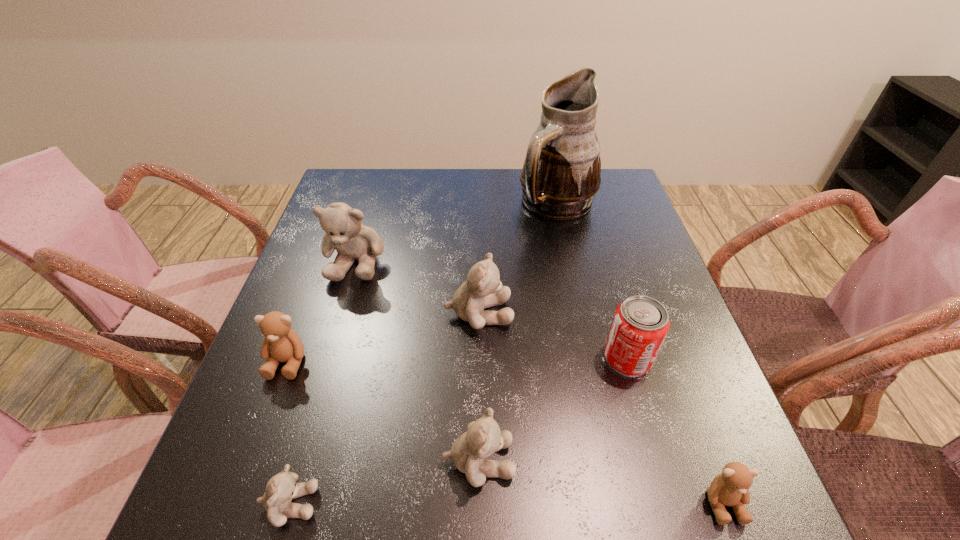
Locate an element on the screen. pitcher is located at coordinates (561, 173).

I want to click on the farthest object, so click(561, 173).

Where is `the farthest gray teddy bear`? The image size is (960, 540). the farthest gray teddy bear is located at coordinates (344, 232).

Where is `the farthest teddy bear`? the farthest teddy bear is located at coordinates (344, 232).

What are the coordinates of `the second tallest teddy bear` in the screenshot? It's located at (483, 289).

Find the location of a particular element. This screenshot has width=960, height=540. the second farthest gray teddy bear is located at coordinates (483, 289).

Identify the location of red can. (640, 324).

Locate an element on the screen. This screenshot has height=540, width=960. the third farthest teddy bear is located at coordinates (281, 344).

You are a GUI agent. You are given a task and a screenshot of the screen. Output one action in this format:
    pyautogui.click(x=<x>, y=<y>)
    Task: Click on the farther brown teddy bear
    The width and height of the screenshot is (960, 540).
    Given the screenshot: What is the action you would take?
    pyautogui.click(x=281, y=344)

Identify the location of the third biggest gray teddy bear. The image size is (960, 540). (483, 438).